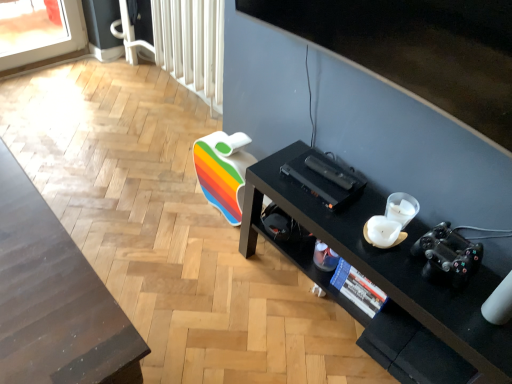
You are a GUI agent. You are given a task and a screenshot of the screen. Output one action in this format:
    pyautogui.click(x=<x>, y=<y>)
    Task: Click on the blank space situated above black matte desk at lower right (from a real-world perspective)
    
    Given the screenshot: What is the action you would take?
    pyautogui.click(x=389, y=243)